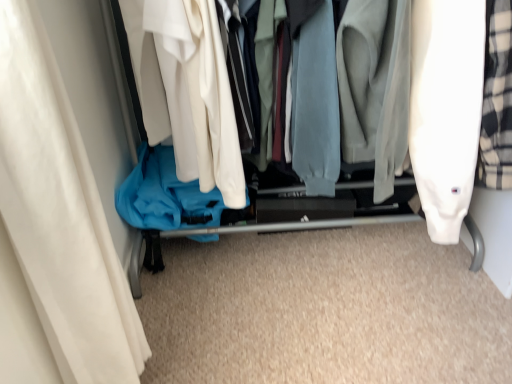
Question: Is white fabric curtain at left smaller than matte blue fabric at center?

Choices:
 (A) yes
 (B) no

Answer: (A)

Question: From the image's perspective, does white fabric curtain at left appear lower than matte blue fabric at center?

Choices:
 (A) yes
 (B) no

Answer: (A)

Question: Does white fabric curtain at left lie behind matte blue fabric at center?

Choices:
 (A) yes
 (B) no

Answer: (B)

Question: From a real-world perspective, is white fabric curtain at left physically above matte blue fabric at center?

Choices:
 (A) no
 (B) yes

Answer: (B)

Question: Is white fabric curtain at left closer to camera compared to matte blue fabric at center?

Choices:
 (A) no
 (B) yes

Answer: (B)

Question: Is white fabric curtain at left not inside matte blue fabric at center?

Choices:
 (A) no
 (B) yes

Answer: (B)

Question: Can you confirm if matte blue fabric at center is shorter than white fabric curtain at left?

Choices:
 (A) no
 (B) yes

Answer: (A)

Question: From the image's perspective, would you say matte blue fabric at center is shown under white fabric curtain at left?

Choices:
 (A) no
 (B) yes

Answer: (A)

Question: Are matte blue fabric at center and white fabric curtain at left located far from each other?

Choices:
 (A) yes
 (B) no

Answer: (B)

Question: Is the position of matte blue fabric at center less distant than that of white fabric curtain at left?

Choices:
 (A) yes
 (B) no

Answer: (B)

Question: Is white fabric curtain at left located within matte blue fabric at center?

Choices:
 (A) yes
 (B) no

Answer: (B)

Question: Does matte blue fabric at center turn towards white fabric curtain at left?

Choices:
 (A) no
 (B) yes

Answer: (B)

Question: From the image's perspective, is white fabric curtain at left above or below matte blue fabric at center?

Choices:
 (A) below
 (B) above

Answer: (A)